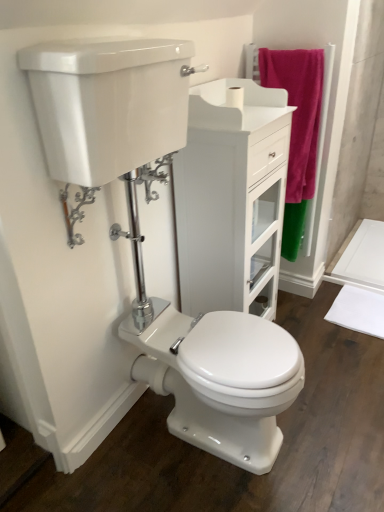
Question: Does chrome metallic lever at upper left, the first plumbing fixture in the front-to-back sequence, have a lesser width compared to white glossy cabinet at center?

Choices:
 (A) yes
 (B) no

Answer: (A)

Question: Is chrome metallic lever at upper left, acting as the first plumbing fixture starting from the bottom, shorter than white glossy cabinet at center?

Choices:
 (A) no
 (B) yes

Answer: (B)

Question: Is chrome metallic lever at upper left, the second plumbing fixture when ordered from top to bottom, closer to the viewer compared to white glossy cabinet at center?

Choices:
 (A) yes
 (B) no

Answer: (A)

Question: Is chrome metallic lever at upper left, the second plumbing fixture from the right, facing away from white glossy cabinet at center?

Choices:
 (A) no
 (B) yes

Answer: (A)

Question: Can you confirm if chrome metallic lever at upper left, the first plumbing fixture in the front-to-back sequence, is bigger than white glossy cabinet at center?

Choices:
 (A) no
 (B) yes

Answer: (A)

Question: From their relative heights in the image, would you say chrome metallic lever at upper left, acting as the first plumbing fixture starting from the bottom, is taller or shorter than white glossy cabinet at center?

Choices:
 (A) short
 (B) tall

Answer: (A)

Question: From a real-world perspective, relative to white glossy cabinet at center, is chrome metallic lever at upper left, the first plumbing fixture in the front-to-back sequence, vertically above or below?

Choices:
 (A) below
 (B) above

Answer: (B)

Question: Which is correct: chrome metallic lever at upper left, the 1th plumbing fixture viewed from the left, is inside white glossy cabinet at center, or outside of it?

Choices:
 (A) inside
 (B) outside

Answer: (B)

Question: In the image, is chrome metallic lever at upper left, the 1th plumbing fixture viewed from the left, positioned in front of or behind white glossy cabinet at center?

Choices:
 (A) behind
 (B) front

Answer: (B)

Question: From their relative heights in the image, would you say white matte toilet paper at upper center is taller or shorter than chrome metallic lever at upper left, the second plumbing fixture from the right?

Choices:
 (A) short
 (B) tall

Answer: (A)

Question: Considering the positions of white matte toilet paper at upper center and chrome metallic lever at upper left, the first plumbing fixture in the front-to-back sequence, in the image, is white matte toilet paper at upper center bigger or smaller than chrome metallic lever at upper left, the first plumbing fixture in the front-to-back sequence,?

Choices:
 (A) small
 (B) big

Answer: (A)

Question: From a real-world perspective, is white matte toilet paper at upper center above or below chrome metallic lever at upper left, the second plumbing fixture from the right?

Choices:
 (A) above
 (B) below

Answer: (A)

Question: Is white matte toilet paper at upper center wider or thinner than chrome metallic lever at upper left, which is counted as the 2th plumbing fixture, starting from the back?

Choices:
 (A) thin
 (B) wide

Answer: (A)

Question: From the image's perspective, is polished chrome flush handle at center, which appears as the 2th plumbing fixture when viewed from the left, positioned above or below chrome metallic lever at upper left, the first plumbing fixture in the front-to-back sequence?

Choices:
 (A) below
 (B) above

Answer: (B)

Question: In terms of width, does polished chrome flush handle at center, placed as the first plumbing fixture when sorted from right to left, look wider or thinner when compared to chrome metallic lever at upper left, the second plumbing fixture from the right?

Choices:
 (A) wide
 (B) thin

Answer: (B)